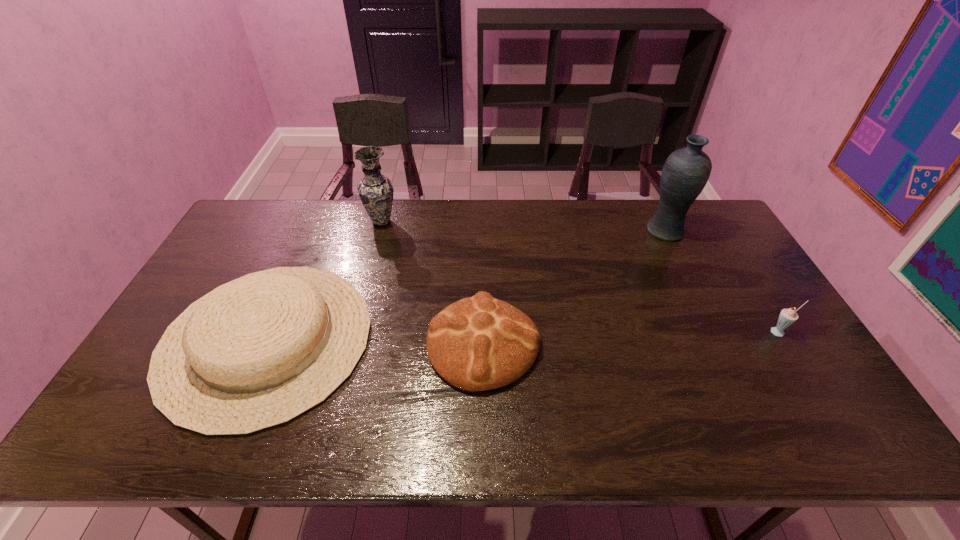
Find the location of a particular element. The height and width of the screenshot is (540, 960). the taller vase is located at coordinates (686, 171).

At what (x,y) coordinates should I click in order to perform the action: click on the right vase. Please return your answer as a coordinate pair (x, y). Image resolution: width=960 pixels, height=540 pixels. Looking at the image, I should click on (686, 171).

Where is `the shorter vase`? This screenshot has width=960, height=540. the shorter vase is located at coordinates (376, 192).

What are the coordinates of `the left vase` in the screenshot? It's located at 376,192.

Find the location of a particular element. The image size is (960, 540). the rightmost object is located at coordinates (787, 317).

Where is `bread`? The height and width of the screenshot is (540, 960). bread is located at coordinates (479, 343).

Where is `sunhat`? This screenshot has width=960, height=540. sunhat is located at coordinates (257, 352).

The height and width of the screenshot is (540, 960). Find the location of `vacant space situated 0.140m on the right of the right vase`. vacant space situated 0.140m on the right of the right vase is located at coordinates (725, 232).

You are a GUI agent. You are given a task and a screenshot of the screen. Output one action in this format:
    pyautogui.click(x=<x>, y=<y>)
    Task: Click on the free space located on the left of the left vase
    Image resolution: width=960 pixels, height=540 pixels.
    Given the screenshot: What is the action you would take?
    pyautogui.click(x=254, y=221)

Find the location of a particular element. free region located 0.290m on the straw side of the rightmost object is located at coordinates (848, 441).